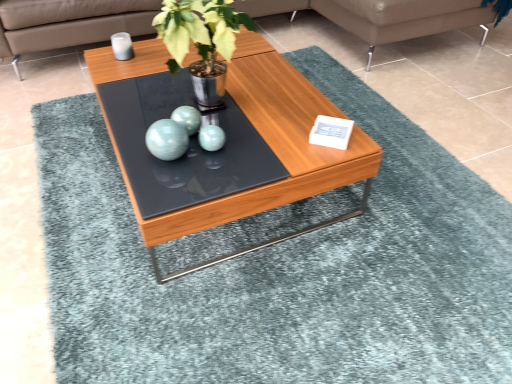
Question: Could leather couch at upper center be considered to be inside metallic green plant at center?

Choices:
 (A) yes
 (B) no

Answer: (B)

Question: Is metallic green plant at center smaller than leather couch at upper center?

Choices:
 (A) no
 (B) yes

Answer: (B)

Question: Considering the relative sizes of metallic green plant at center and leather couch at upper center in the image provided, is metallic green plant at center thinner than leather couch at upper center?

Choices:
 (A) yes
 (B) no

Answer: (A)

Question: From a real-world perspective, is metallic green plant at center under leather couch at upper center?

Choices:
 (A) yes
 (B) no

Answer: (B)

Question: From a real-world perspective, is metallic green plant at center on top of leather couch at upper center?

Choices:
 (A) yes
 (B) no

Answer: (A)

Question: Would you say metallic green plant at center is inside or outside leather couch at upper center?

Choices:
 (A) inside
 (B) outside

Answer: (B)

Question: From a real-world perspective, relative to leather couch at upper center, is metallic green plant at center vertically above or below?

Choices:
 (A) below
 (B) above

Answer: (B)

Question: In terms of width, does metallic green plant at center look wider or thinner when compared to leather couch at upper center?

Choices:
 (A) wide
 (B) thin

Answer: (B)

Question: Is metallic green plant at center taller or shorter than leather couch at upper center?

Choices:
 (A) tall
 (B) short

Answer: (A)

Question: Looking at their shapes, would you say metallic green plant at center is wider or thinner than wooden coffee table at center?

Choices:
 (A) wide
 (B) thin

Answer: (B)

Question: From the image's perspective, relative to wooden coffee table at center, is metallic green plant at center above or below?

Choices:
 (A) above
 (B) below

Answer: (A)

Question: Is point (169, 3) closer or farther from the camera than point (169, 228)?

Choices:
 (A) farther
 (B) closer

Answer: (A)

Question: Based on their sizes in the image, would you say metallic green plant at center is bigger or smaller than wooden coffee table at center?

Choices:
 (A) small
 (B) big

Answer: (A)

Question: Visually, is teal glossy sphere at center positioned to the left or to the right of metallic green plant at center?

Choices:
 (A) right
 (B) left

Answer: (B)

Question: Considering the positions of teal glossy sphere at center and metallic green plant at center in the image, is teal glossy sphere at center taller or shorter than metallic green plant at center?

Choices:
 (A) tall
 (B) short

Answer: (B)